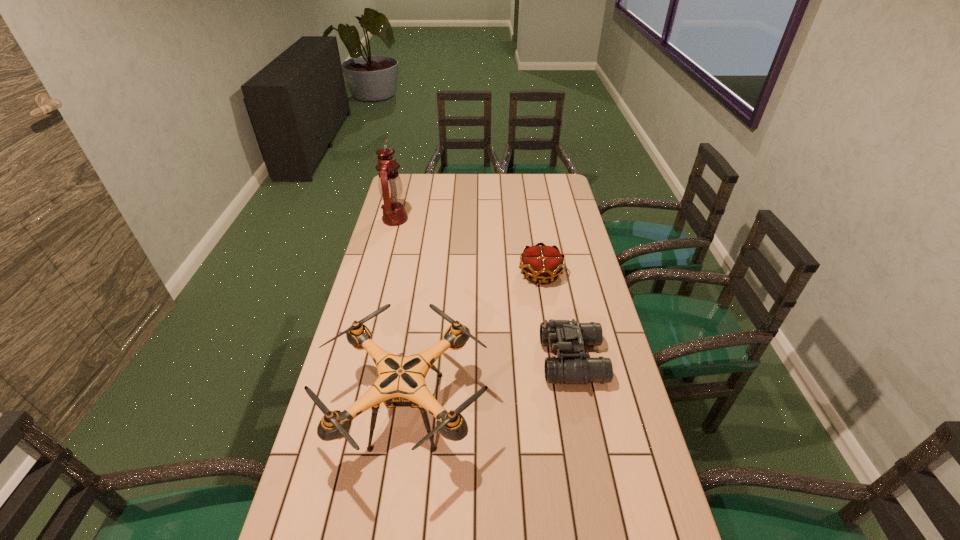
The image size is (960, 540). I want to click on vacant area that lies between the third nearest object and the drone, so click(474, 342).

At what (x,y) coordinates should I click in order to perform the action: click on vacant point located between the oil lamp and the second shortest object. Please return your answer as a coordinate pair (x, y). This screenshot has height=540, width=960. Looking at the image, I should click on (484, 289).

Image resolution: width=960 pixels, height=540 pixels. What are the coordinates of `free area in between the second shortest object and the third shortest object` in the screenshot? It's located at (490, 385).

The height and width of the screenshot is (540, 960). Find the location of `vacant space that's between the third tallest object and the oil lamp`. vacant space that's between the third tallest object and the oil lamp is located at coordinates (484, 289).

At what (x,y) coordinates should I click in order to perform the action: click on free space that is in between the oil lamp and the crown. Please return your answer as a coordinate pair (x, y). Looking at the image, I should click on (468, 246).

Identify the location of the third closest object relative to the second shortest object. (390, 186).

This screenshot has height=540, width=960. Identify the location of the third closest object relative to the farthest object. (571, 366).